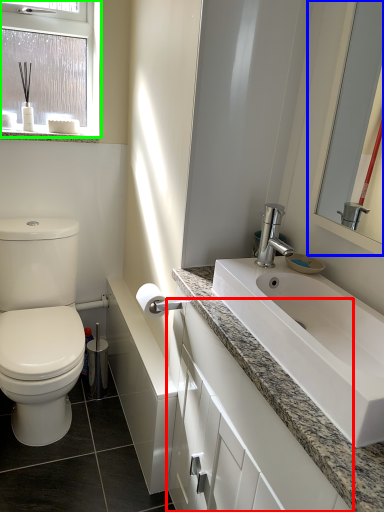
Question: Based on their relative distances, which object is farther from bathroom cabinet (highlighted by a red box)? Choose from mirror (highlighted by a blue box) and window (highlighted by a green box).

Choices:
 (A) mirror
 (B) window

Answer: (B)